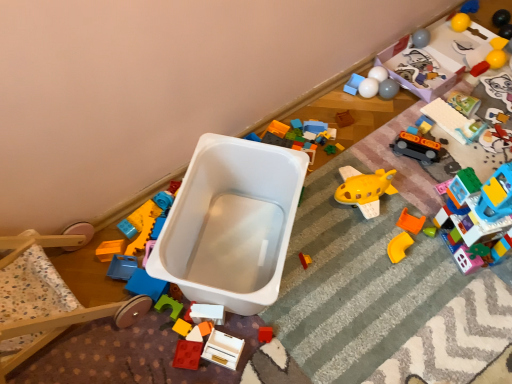
Locate an element on the screen. This screenshot has width=512, height=384. free space between orange plastic block at lower right, placed as the 10th toy when sorted from left to right, and wooden toy box at center, arranged as the fourth toy when viewed from the left is located at coordinates 325,281.